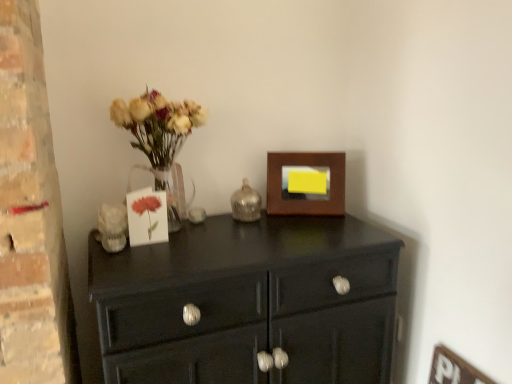
At what (x,y) coordinates should I click in order to perform the action: click on vacant space in between wooden picture frame at upper right and shiny metallic candle holder at center. Please return your answer as a coordinate pair (x, y). The width and height of the screenshot is (512, 384). Looking at the image, I should click on (287, 217).